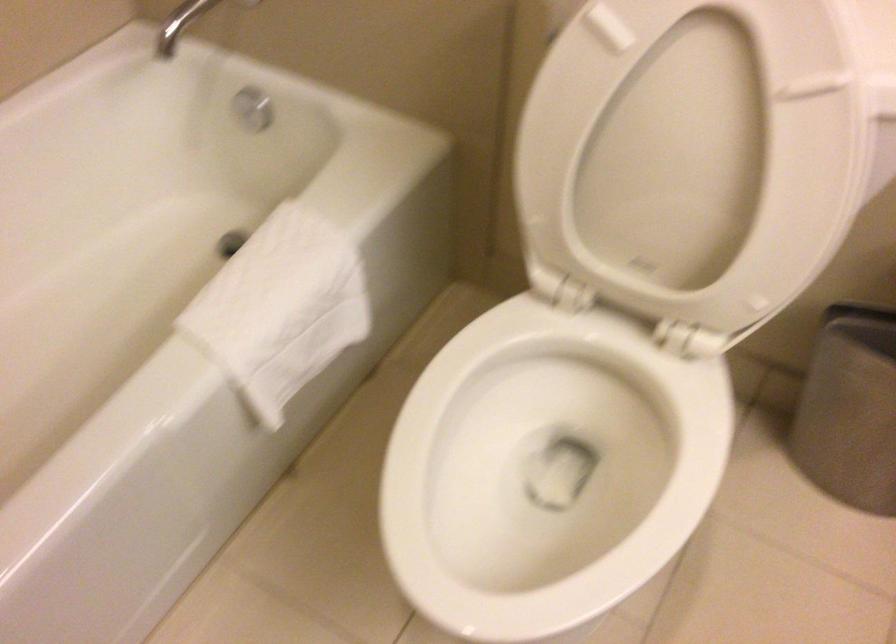
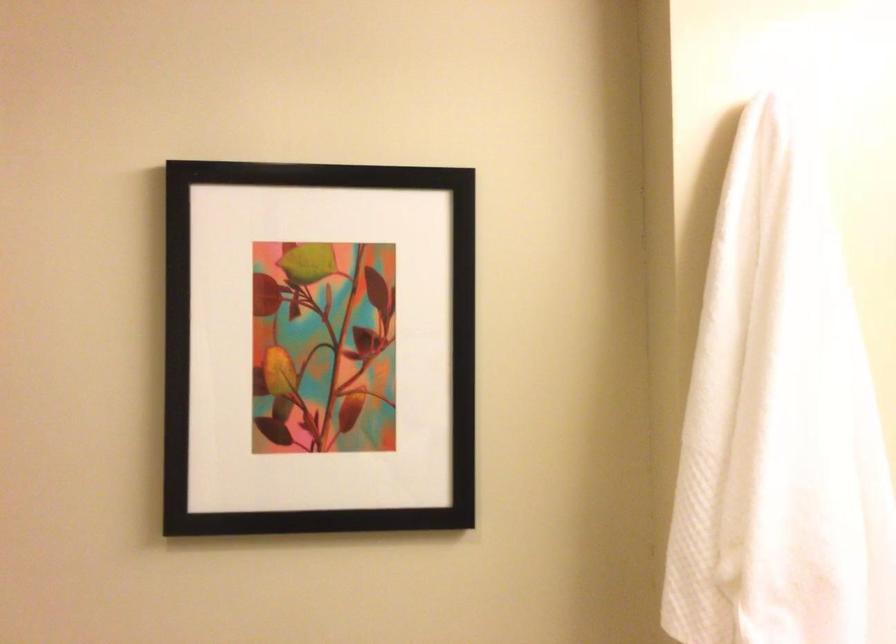
How did the camera likely rotate?

The camera rotated toward right-up.